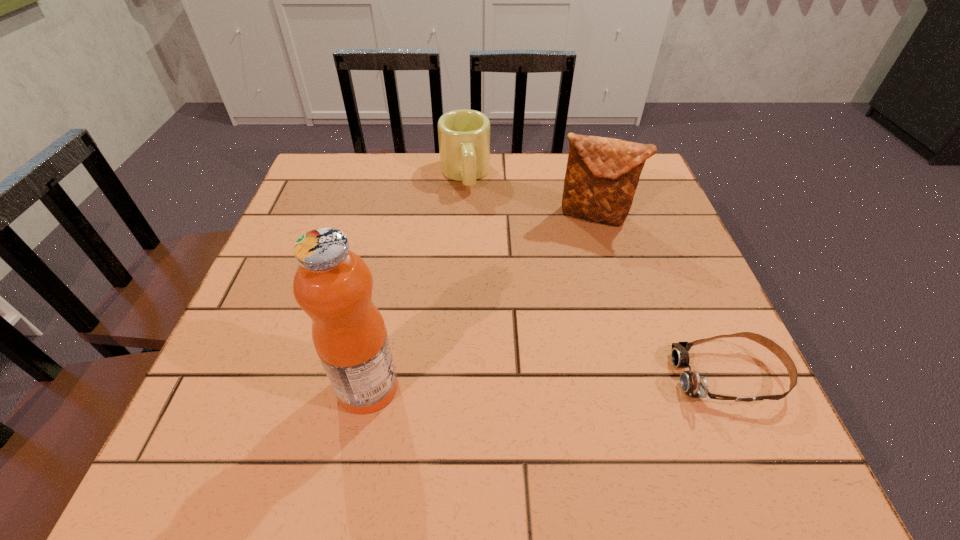
You are a GUI agent. You are given a task and a screenshot of the screen. Output one action in this format:
    pyautogui.click(x=<x>, y=<y>)
    Task: Click on the vacant area situated 0.320m on the front-facing side of the shortest object
    Image resolution: width=960 pixels, height=540 pixels.
    Given the screenshot: What is the action you would take?
    pyautogui.click(x=493, y=376)

The width and height of the screenshot is (960, 540). I want to click on free spot located on the open side of the third nearest object, so click(540, 318).

Image resolution: width=960 pixels, height=540 pixels. What are the coordinates of `free point located 0.270m on the open side of the third nearest object` in the screenshot? It's located at (545, 307).

Where is `free space located on the open side of the third nearest object`? free space located on the open side of the third nearest object is located at coordinates (542, 315).

The height and width of the screenshot is (540, 960). Find the location of `vacant region located 0.280m with the handle on the side of the second object from left to right`. vacant region located 0.280m with the handle on the side of the second object from left to right is located at coordinates (481, 271).

Locate an element on the screen. The width and height of the screenshot is (960, 540). blank space located 0.170m with the handle on the side of the second object from left to right is located at coordinates (475, 238).

The image size is (960, 540). I want to click on free space located with the handle on the side of the second object from left to right, so click(483, 281).

At what (x,y) coordinates should I click in order to perform the action: click on clutch bag that is at the far edge. Please return your answer as a coordinate pair (x, y). The image size is (960, 540). Looking at the image, I should click on (602, 174).

Identify the location of mug present at the far edge. This screenshot has height=540, width=960. (464, 135).

You are a GUI agent. You are given a task and a screenshot of the screen. Output one action in this format:
    pyautogui.click(x=<x>, y=<y>)
    Task: Click on the fruit juice present at the near edge
    The height and width of the screenshot is (540, 960).
    Given the screenshot: What is the action you would take?
    pyautogui.click(x=333, y=285)